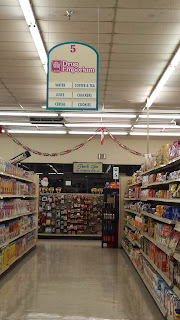
You are a GUI agent. You are given a task and a screenshot of the screen. Output one action in this format:
    pyautogui.click(x=<x>, y=<y>)
    Task: Click on the shelf
    This screenshot has height=320, width=180.
    Given the screenshot: What is the action you would take?
    pyautogui.click(x=161, y=200), pyautogui.click(x=165, y=221), pyautogui.click(x=154, y=264), pyautogui.click(x=17, y=235)